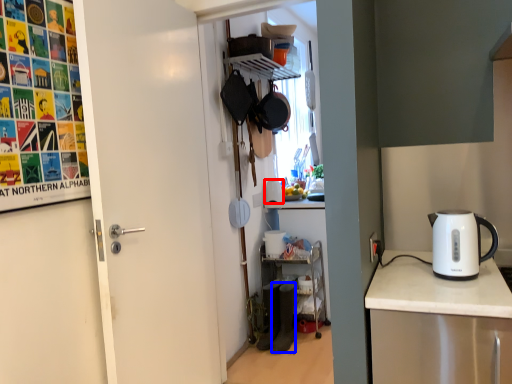
Question: Which object appears closest to the camera in this image, appliance (highlighted by a red box) or appliance (highlighted by a blue box)?

Choices:
 (A) appliance
 (B) appliance

Answer: (B)